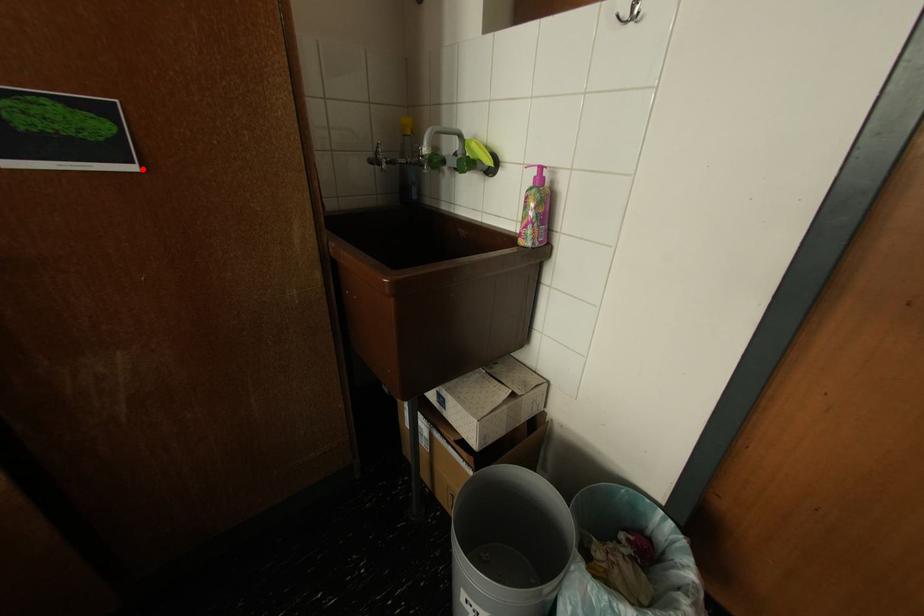
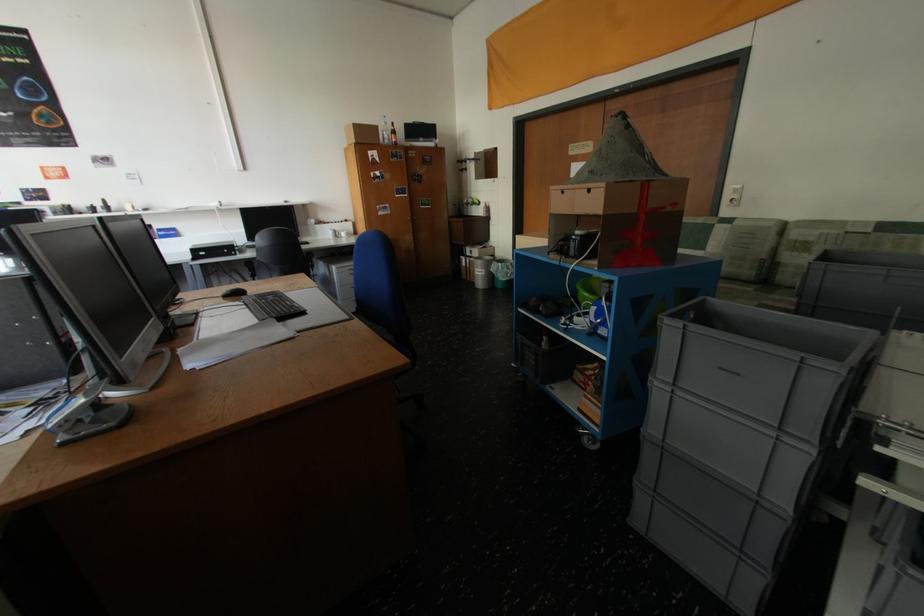
Question: I am providing you with two images of the same scene from different viewpoints. A red point is shown in image1. For the corresponding object point in image2, is it positioned nearer or farther from the camera?

Choices:
 (A) Nearer
 (B) Farther

Answer: (A)